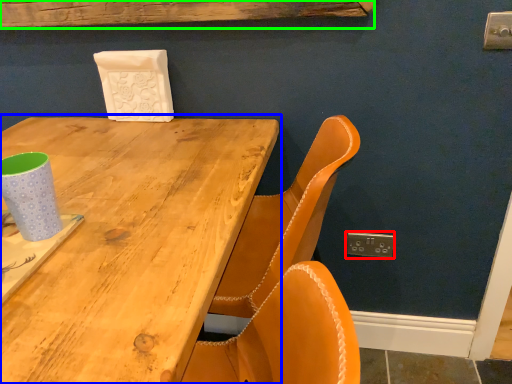
Question: Based on their relative distances, which object is farther from electric outlet (highlighted by a red box)? Choose from table (highlighted by a blue box) and plank (highlighted by a green box).

Choices:
 (A) table
 (B) plank

Answer: (B)